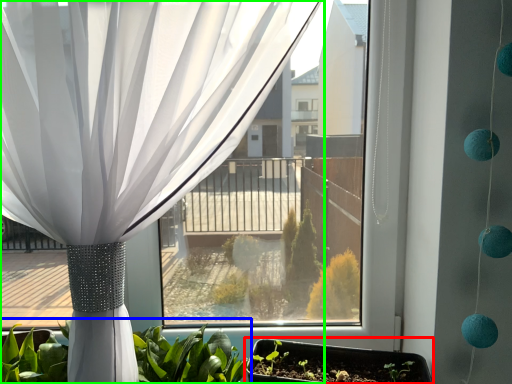
Question: Which object is the closest to the flowerpot (highlighted by a red box)? Choose among these: houseplant (highlighted by a blue box) or curtain (highlighted by a green box).

Choices:
 (A) houseplant
 (B) curtain

Answer: (A)